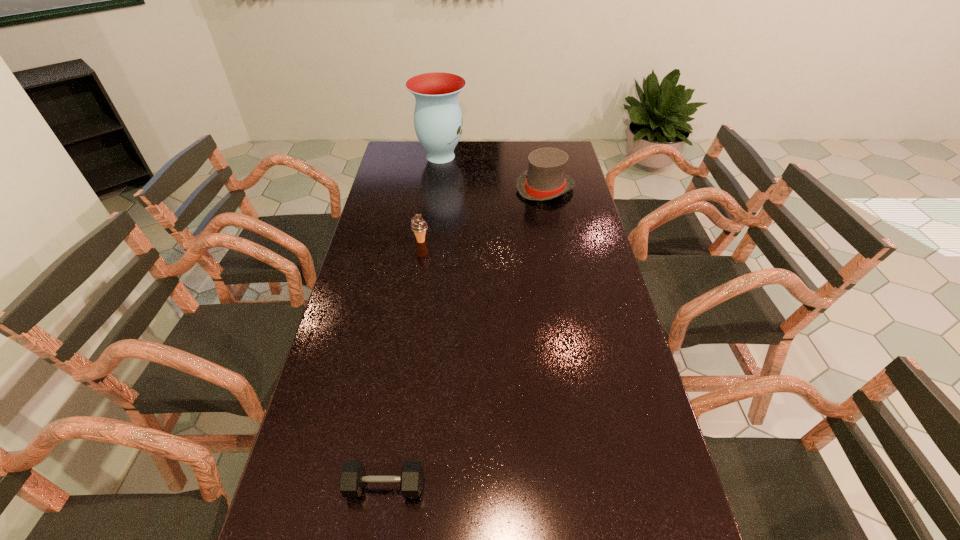
In order to click on unoccupied area between the rightmost object and the farthest object in this screenshot , I will do `click(492, 172)`.

This screenshot has height=540, width=960. I want to click on vacant space that is in between the third shortest object and the farthest object, so click(x=492, y=172).

This screenshot has height=540, width=960. Identify the location of object that ranks as the second closest to the icecream. (438, 123).

Locate which object ranks third in proximity to the rightmost object. Please provide its 2D coordinates. Your answer should be formatted as a tuple, i.e. [(x, y)], where the tuple contains the x and y coordinates of a point satisfying the conditions above.

[(352, 478)]

Where is `vacant region that satisfies the following two spatial constraints: 1. on the back side of the shortest object; 2. on the left side of the vase`? This screenshot has height=540, width=960. vacant region that satisfies the following two spatial constraints: 1. on the back side of the shortest object; 2. on the left side of the vase is located at coordinates (434, 156).